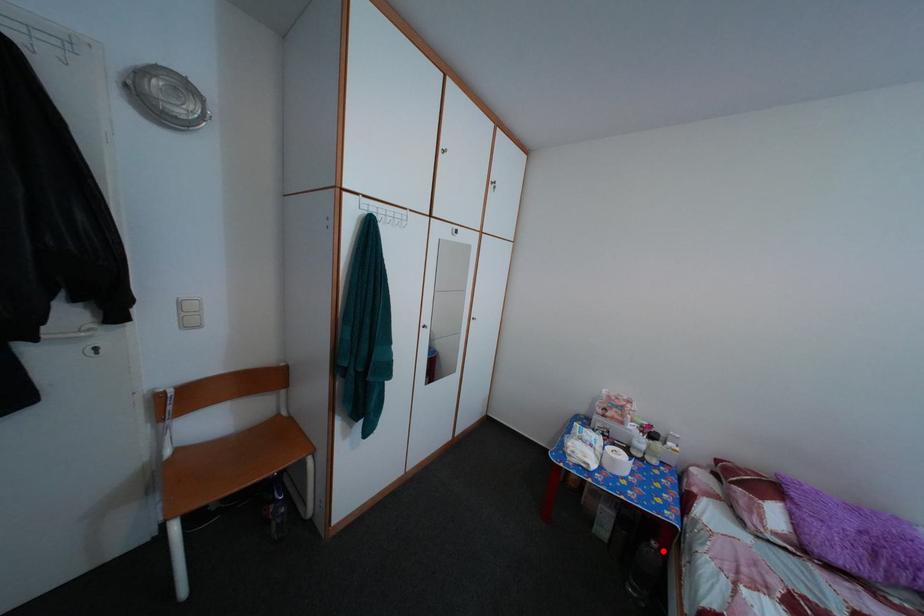
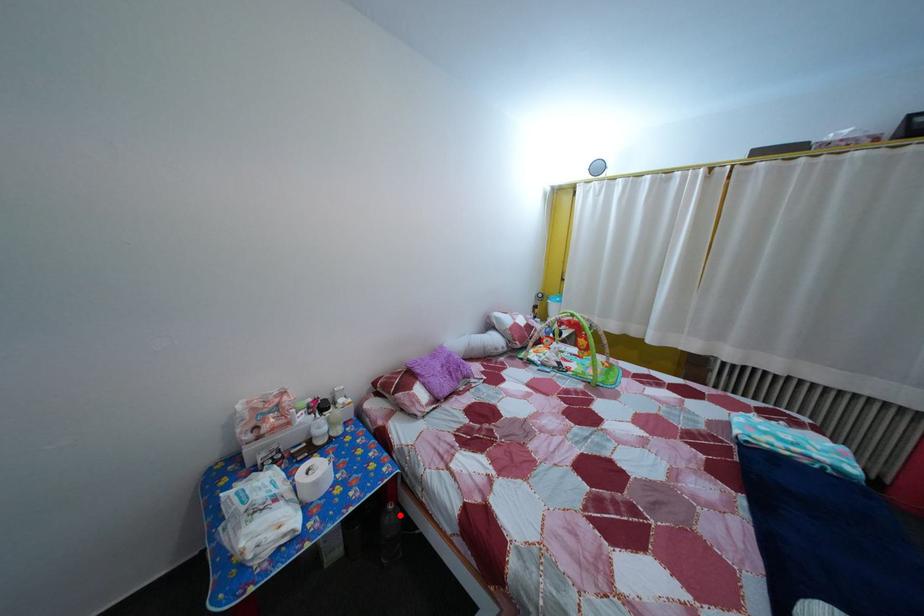
I am providing you with two images of the same scene from different viewpoints. A red point is marked on the first image and another point is marked on the second image. Are the points marked in image1 and image2 representing the same 3D position?

Yes